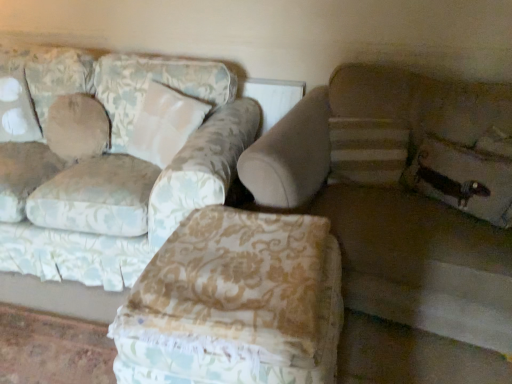
Question: Based on their sizes in the image, would you say floral fabric ottoman at center is bigger or smaller than beige fabric pillow at upper left, placed as the 2th pillow when sorted from front to back?

Choices:
 (A) big
 (B) small

Answer: (A)

Question: In terms of width, does floral fabric ottoman at center look wider or thinner when compared to beige fabric pillow at upper left, the first pillow positioned from the back?

Choices:
 (A) wide
 (B) thin

Answer: (A)

Question: Which of these objects is positioned farthest from the floral fabric ottoman at center?

Choices:
 (A) beige fabric pillow at upper left, placed as the 2th pillow when sorted from front to back
 (B) floral fabric pillow at lower right, the 2th pillow viewed from the back
 (C) beige fabric couch at right, the second studio couch from the left
 (D) floral fabric couch at left, which appears as the 1th studio couch when viewed from the left

Answer: (A)

Question: Which object is the closest to the floral fabric couch at left, the 2th studio couch in the right-to-left sequence?

Choices:
 (A) floral fabric ottoman at center
 (B) floral fabric pillow at lower right, the first pillow viewed from the front
 (C) beige fabric couch at right, the first studio couch when ordered from right to left
 (D) beige fabric pillow at upper left, arranged as the 2th pillow when viewed from the right

Answer: (D)